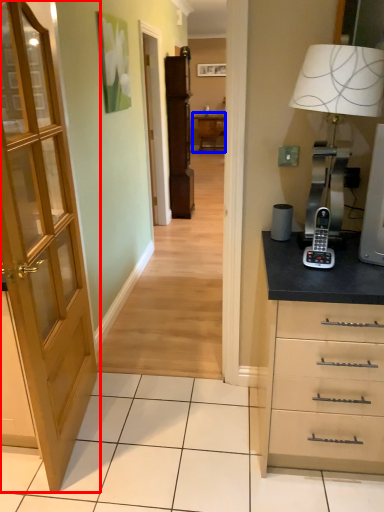
Question: Which object appears farthest to the camera in this image, door (highlighted by a red box) or table (highlighted by a blue box)?

Choices:
 (A) door
 (B) table

Answer: (B)